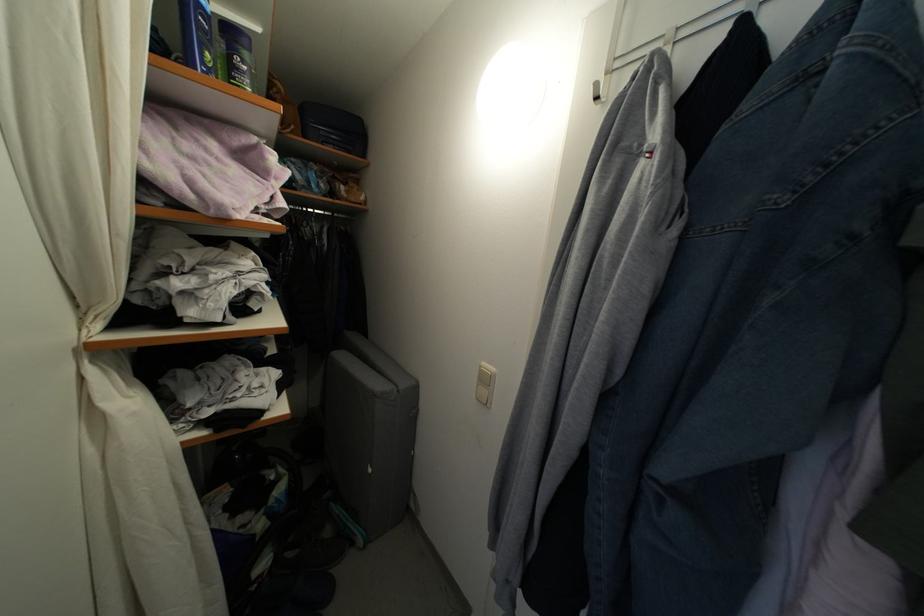
Find where to pull the dark blue suitcase. Please return your answer as a coordinate pair (x, y).

(333, 128)